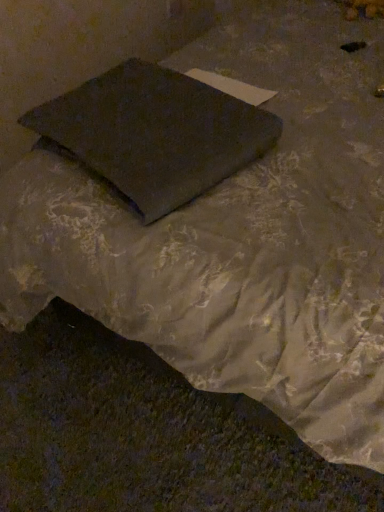
This screenshot has height=512, width=384. Describe the element at coordinates (156, 133) in the screenshot. I see `matte gray pillow at center` at that location.

Identify the location of matte gray pillow at center. (156, 133).

Measure the distance between matte gray pillow at center and camera.

A: They are 30.31 inches apart.

This screenshot has width=384, height=512. What are the coordinates of `matte gray pillow at center` in the screenshot? It's located at (156, 133).